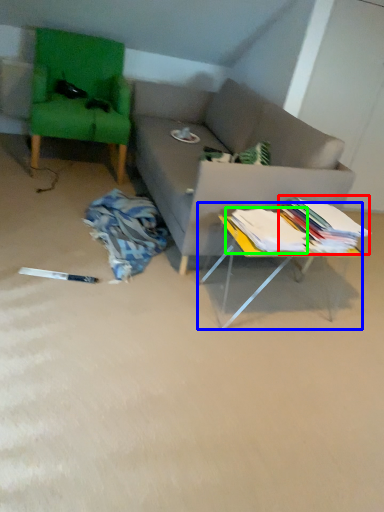
Question: Considering the real-world distances, which object is farthest from book (highlighted by a red box)? table (highlighted by a blue box) or book (highlighted by a green box)?

Choices:
 (A) table
 (B) book

Answer: (A)